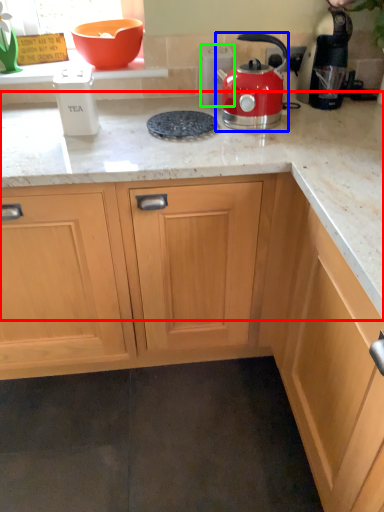
Question: Which object is the farthest from countertop (highlighted by a red box)? Choose among these: kitchen appliance (highlighted by a blue box) or kitchen appliance (highlighted by a green box).

Choices:
 (A) kitchen appliance
 (B) kitchen appliance

Answer: (B)